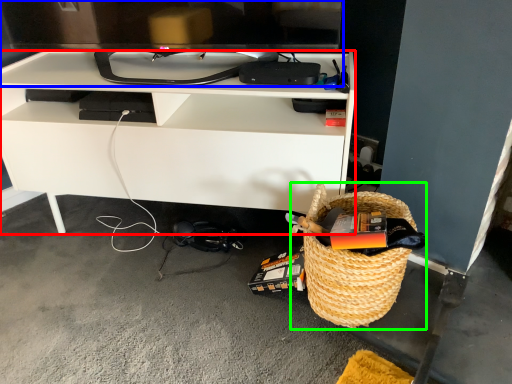
Question: Considering the real-world distances, which object is closest to desk (highlighted by a red box)? television (highlighted by a blue box) or picnic basket (highlighted by a green box).

Choices:
 (A) television
 (B) picnic basket

Answer: (A)